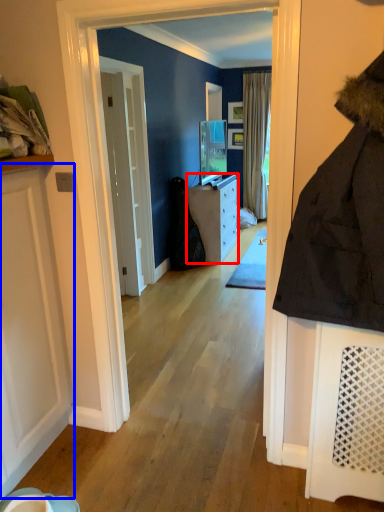
Question: Which of the following is the farthest to the observer, cabinetry (highlighted by a red box) or door (highlighted by a blue box)?

Choices:
 (A) cabinetry
 (B) door

Answer: (A)